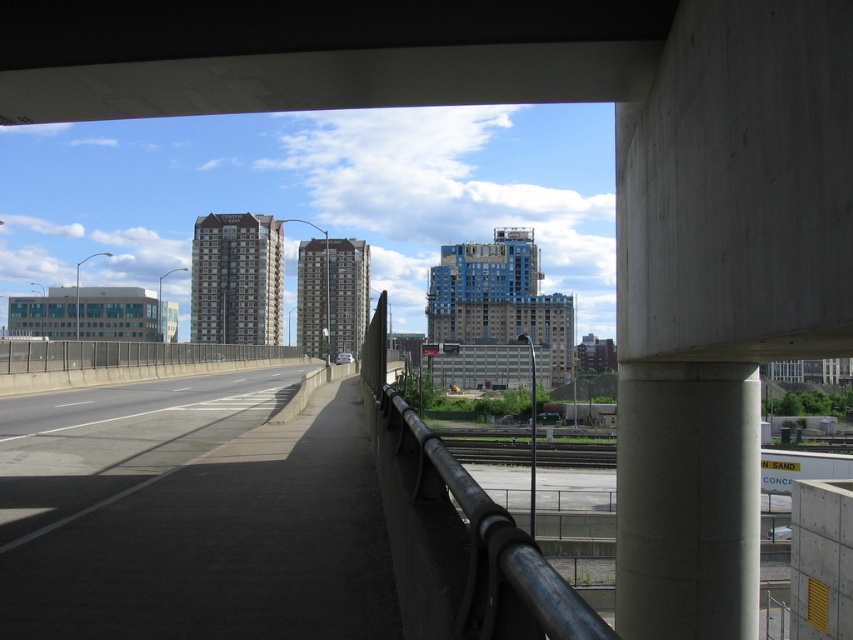
Question: Is concrete at upper center thinner than gray concrete pillar at center-right?

Choices:
 (A) no
 (B) yes

Answer: (A)

Question: Which point appears closest to the camera in this image?

Choices:
 (A) [618, 51]
 (B) [706, 451]
 (C) [315, 614]
 (D) [129, 362]

Answer: (C)

Question: Estimate the real-world distances between objects in this image. Which object is closer to the black asphalt highway at lower left?

Choices:
 (A) black metal fence at left
 (B) black metal/rail at center
 (C) gray concrete pillar at center-right
 (D) concrete at upper center

Answer: (B)

Question: Which point is farther to the camera?

Choices:
 (A) (103, 362)
 (B) (706, 384)

Answer: (A)

Question: Where is concrete at upper center located in relation to black metal fence at left in the image?

Choices:
 (A) below
 (B) above

Answer: (B)

Question: Does concrete at upper center appear over gray concrete pillar at center-right?

Choices:
 (A) yes
 (B) no

Answer: (A)